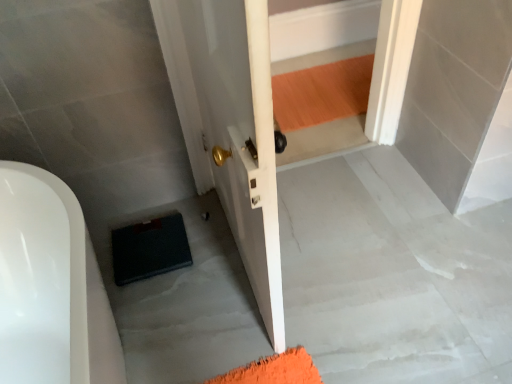
Image resolution: width=512 pixels, height=384 pixels. I want to click on vacant space behind dark blue rubber mat at lower left, so click(x=165, y=210).